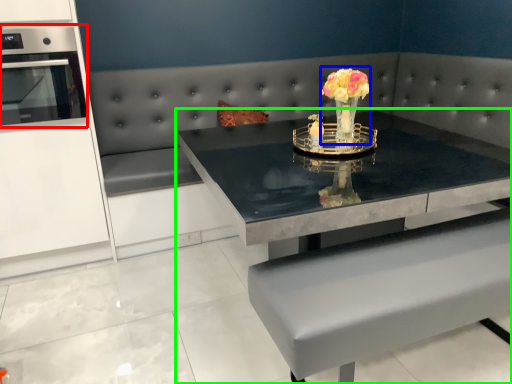
Question: Which object is the farthest from appliance (highlighted by a red box)? Choose among these: floral arrangement (highlighted by a blue box) or table (highlighted by a green box).

Choices:
 (A) floral arrangement
 (B) table

Answer: (A)